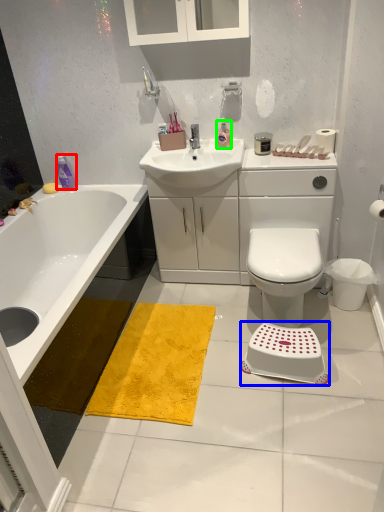
Question: Based on their relative distances, which object is nearer to toiletry (highlighted by a red box)? Choose from step stool (highlighted by a blue box) and toiletry (highlighted by a green box).

Choices:
 (A) step stool
 (B) toiletry

Answer: (B)